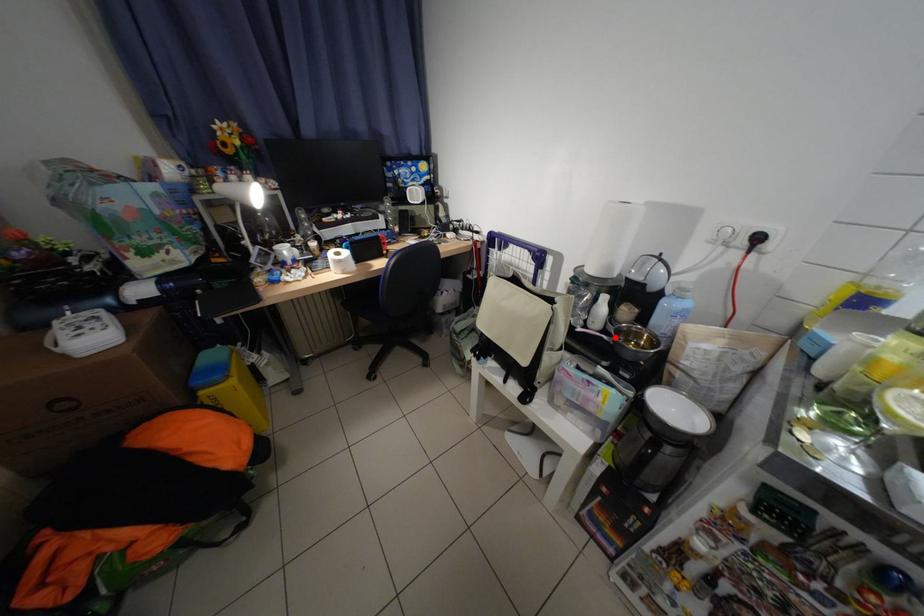
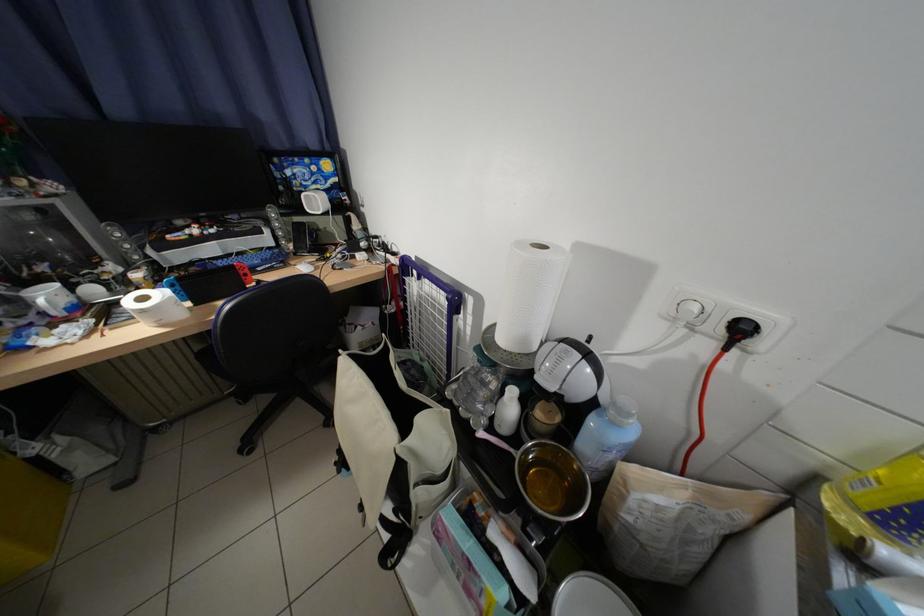
Where in the second image is the point corresponding to the highlighted location from the first image?

(524, 453)